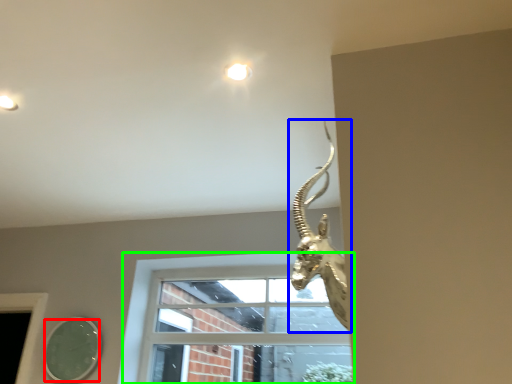
Question: Which object is positioned closest to mirror (highlighted by a red box)? Select from animal (highlighted by a blue box) and window (highlighted by a green box).

Choices:
 (A) animal
 (B) window

Answer: (B)